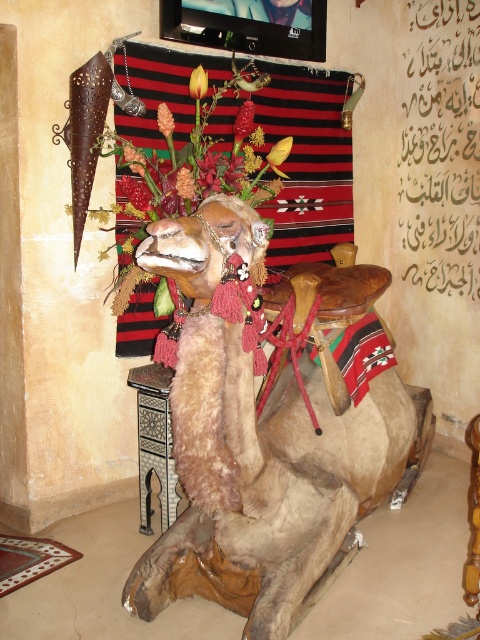
Does red velvet flower at upper center have a lesser height compared to orange matte flower at upper center?

Incorrect, red velvet flower at upper center's height does not fall short of orange matte flower at upper center's.

Is red velvet flower at upper center closer to camera compared to orange matte flower at upper center?

Yes, red velvet flower at upper center is in front of orange matte flower at upper center.

At what (x,y) coordinates should I click in order to perform the action: click on red velvet flower at upper center. Please return your answer as a coordinate pair (x, y). Looking at the image, I should click on (184, 182).

Find the location of a particular element. The width and height of the screenshot is (480, 640). red velvet flower at upper center is located at coordinates (184, 182).

Who is lower down, floral bouquet at upper center or smooth red flower at center?

Positioned lower is floral bouquet at upper center.

Consider the image. Who is more forward, [176,202] or [240,115]?

Point [176,202] is more forward.

You are a GUI agent. You are given a task and a screenshot of the screen. Output one action in this format:
    pyautogui.click(x=<x>, y=<y>)
    Task: Click on the floral bouquet at upper center
    The image size is (480, 640).
    Given the screenshot: What is the action you would take?
    (x=199, y=161)

Does point (148, 252) lie behind point (398, 221)?

No, (148, 252) is in front of (398, 221).

Which is behind, point (315, 365) or point (467, 204)?

Point (467, 204)

Who is more distant from viewer, (162, 237) or (409, 269)?

Positioned behind is point (409, 269).

Where is `furry beige camel at center`? furry beige camel at center is located at coordinates (256, 449).